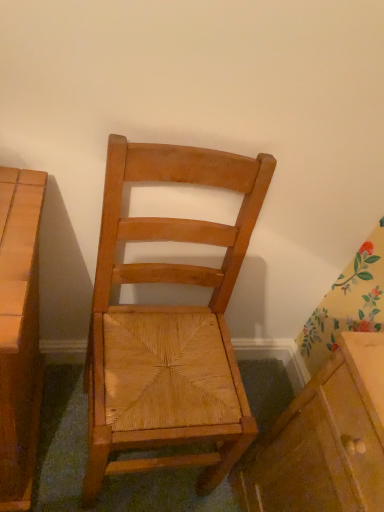
Question: Can you confirm if natural wood chair at center is smaller than matte wood cabinet at lower right?

Choices:
 (A) yes
 (B) no

Answer: (B)

Question: Is natural wood chair at center directly adjacent to matte wood cabinet at lower right?

Choices:
 (A) no
 (B) yes

Answer: (A)

Question: Are natural wood chair at center and matte wood cabinet at lower right located far from each other?

Choices:
 (A) no
 (B) yes

Answer: (A)

Question: Is natural wood chair at center positioned in front of matte wood cabinet at lower right?

Choices:
 (A) no
 (B) yes

Answer: (B)

Question: From a real-world perspective, is natural wood chair at center positioned over matte wood cabinet at lower right based on gravity?

Choices:
 (A) yes
 (B) no

Answer: (A)

Question: Is natural wood chair at center taller than matte wood cabinet at lower right?

Choices:
 (A) no
 (B) yes

Answer: (B)

Question: Would you say matte wood cabinet at lower right is outside natural wood chair at center?

Choices:
 (A) no
 (B) yes

Answer: (B)

Question: From a real-world perspective, is matte wood cabinet at lower right below natural wood chair at center?

Choices:
 (A) no
 (B) yes

Answer: (B)

Question: Does matte wood cabinet at lower right have a smaller size compared to natural wood chair at center?

Choices:
 (A) yes
 (B) no

Answer: (A)

Question: From the image's perspective, is matte wood cabinet at lower right over natural wood chair at center?

Choices:
 (A) no
 (B) yes

Answer: (A)

Question: Is matte wood cabinet at lower right positioned in front of natural wood chair at center?

Choices:
 (A) yes
 (B) no

Answer: (B)

Question: Considering the relative sizes of matte wood cabinet at lower right and natural wood chair at center in the image provided, is matte wood cabinet at lower right bigger than natural wood chair at center?

Choices:
 (A) no
 (B) yes

Answer: (A)

Question: Is point (362, 480) closer or farther from the camera than point (137, 369)?

Choices:
 (A) closer
 (B) farther

Answer: (A)